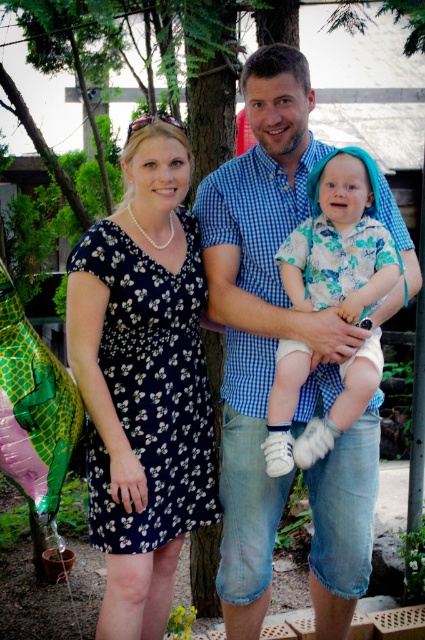
Is blue checkered shirt at center below floral fabric shirt at center?

Yes, blue checkered shirt at center is below floral fabric shirt at center.

Which is in front, point (232, 541) or point (328, 296)?

Positioned in front is point (328, 296).

Identify the location of blue checkered shirt at center. (261, 317).

Is blue checkered shirt at center closer to the viewer compared to black floral dress at left?

No, it is behind black floral dress at left.

Measure the distance between point (x=249, y=371) and camera.

Point (x=249, y=371) is 3.79 meters away from camera.

Where is `blue checkered shirt at center`? This screenshot has height=640, width=425. blue checkered shirt at center is located at coordinates point(261,317).

Measure the distance between black floral dress at left and camera.

black floral dress at left is 3.42 meters from camera.

Between black floral dress at left and floral fabric shirt at center, which one is positioned lower?

black floral dress at left

Locate an element on the screen. This screenshot has width=425, height=640. black floral dress at left is located at coordinates (144, 381).